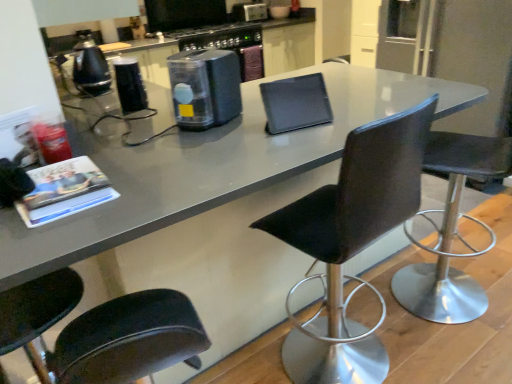
The height and width of the screenshot is (384, 512). What do you see at coordinates (249, 12) in the screenshot? I see `metallic silver toaster at upper center, the third appliance from the bottom` at bounding box center [249, 12].

Locate an element on the screen. This screenshot has height=384, width=512. black leather chair at center, the 2th chair positioned from the right is located at coordinates (351, 243).

Identify the location of matte gray countertop at center. The width and height of the screenshot is (512, 384). (212, 166).

Measure the distance between point [218,92] and camera.

Point [218,92] and camera are 1.46 meters apart from each other.

The image size is (512, 384). Find the location of `transparent plastic container at center, acting as the first appliance starting from the front`. transparent plastic container at center, acting as the first appliance starting from the front is located at coordinates (205, 88).

The image size is (512, 384). What do you see at coordinates (90, 66) in the screenshot? I see `black glossy kettle at left, the first appliance viewed from the left` at bounding box center [90, 66].

What are the coordinates of `black leather chair at lower left, marked as the third chair in a right-to-left arrangement` in the screenshot? It's located at (100, 331).

Is black leather chair at center, the 2th chair positioned from the right, facing towards black leather chair at right, the first chair in the right-to-left sequence?

No, black leather chair at center, the 2th chair positioned from the right, does not turn towards black leather chair at right, the first chair in the right-to-left sequence.

From the picture: Does black leather chair at center, the 2th chair positioned from the right, touch black leather chair at right, the third chair from the left?

black leather chair at center, the 2th chair positioned from the right, is not next to black leather chair at right, the third chair from the left, and they're not touching.

Image resolution: width=512 pixels, height=384 pixels. There is a black leather chair at right, the first chair in the right-to-left sequence. Find the location of `the 1st chair below it (from the image's perspective)`. the 1st chair below it (from the image's perspective) is located at coordinates (351, 243).

Which object is thinner, metallic silver toaster at upper center, the 3th appliance positioned from the left, or black glossy kettle at left, which is counted as the second appliance, starting from the front?

black glossy kettle at left, which is counted as the second appliance, starting from the front, is thinner.

Relative to black glossy kettle at left, which ranks as the third appliance in right-to-left order, is metallic silver toaster at upper center, arranged as the third appliance when viewed from the front, in front or behind?

metallic silver toaster at upper center, arranged as the third appliance when viewed from the front, is positioned farther from the viewer than black glossy kettle at left, which ranks as the third appliance in right-to-left order.

From the image's perspective, is metallic silver toaster at upper center, arranged as the first appliance when viewed from the back, above black glossy kettle at left, which is counted as the second appliance, starting from the front?

Indeed, from the image's perspective, metallic silver toaster at upper center, arranged as the first appliance when viewed from the back, is shown above black glossy kettle at left, which is counted as the second appliance, starting from the front.

Would you say metallic silver toaster at upper center, arranged as the third appliance when viewed from the front, is inside or outside black glossy kettle at left, the second appliance viewed from the back?

metallic silver toaster at upper center, arranged as the third appliance when viewed from the front, is not inside black glossy kettle at left, the second appliance viewed from the back, it's outside.

Is matte gray countertop at center not close to metallic silver toaster at upper center, the 3th appliance positioned from the left?

Yes.

Is point (201, 180) positioned in front of point (252, 4)?

Yes, point (201, 180) is closer to viewer.

From the image's perspective, starting from the matte gray countertop at center, which appliance is the 3rd one above? Please provide its 2D coordinates.

[(249, 12)]

Considering the relative positions of matte gray countertop at center and metallic silver toaster at upper center, arranged as the first appliance when viewed from the back, in the image provided, is matte gray countertop at center to the right of metallic silver toaster at upper center, arranged as the first appliance when viewed from the back, from the viewer's perspective?

Correct, you'll find matte gray countertop at center to the right of metallic silver toaster at upper center, arranged as the first appliance when viewed from the back.

Would you consider black leather chair at right, the third chair from the left, to be distant from transparent plastic container at center, marked as the 3th appliance in a top-to-bottom arrangement?

Yes, black leather chair at right, the third chair from the left, and transparent plastic container at center, marked as the 3th appliance in a top-to-bottom arrangement, are located far from each other.

Which chair is the 1st one when counting from the front of the transparent plastic container at center, marked as the second appliance in a right-to-left arrangement? Please provide its 2D coordinates.

[(451, 231)]

Which of these two, black leather chair at right, the third chair from the left, or transparent plastic container at center, marked as the 3th appliance in a top-to-bottom arrangement, is smaller?

Smaller between the two is transparent plastic container at center, marked as the 3th appliance in a top-to-bottom arrangement.

Is point (455, 188) closer to camera compared to point (208, 80)?

No, it is not.

Considering the relative sizes of transparent plastic container at center, marked as the second appliance in a right-to-left arrangement, and black leather chair at lower left, marked as the third chair in a right-to-left arrangement, in the image provided, is transparent plastic container at center, marked as the second appliance in a right-to-left arrangement, smaller than black leather chair at lower left, marked as the third chair in a right-to-left arrangement,?

Correct, transparent plastic container at center, marked as the second appliance in a right-to-left arrangement, occupies less space than black leather chair at lower left, marked as the third chair in a right-to-left arrangement.

Which is behind, point (175, 117) or point (203, 328)?

The point (175, 117) is farther.

How many degrees apart are the facing directions of transparent plastic container at center, marked as the second appliance in a right-to-left arrangement, and black leather chair at lower left, marked as the third chair in a right-to-left arrangement?

There is a 58.7-degree angle between the facing directions of transparent plastic container at center, marked as the second appliance in a right-to-left arrangement, and black leather chair at lower left, marked as the third chair in a right-to-left arrangement.

How distant is transparent plastic container at center, marked as the 3th appliance in a top-to-bottom arrangement, from black leather chair at lower left, marked as the third chair in a right-to-left arrangement?

transparent plastic container at center, marked as the 3th appliance in a top-to-bottom arrangement, and black leather chair at lower left, marked as the third chair in a right-to-left arrangement, are 73.87 centimeters apart from each other.

Where is `appliance below the black glossy kettle at left, the second appliance viewed from the back (from the image's perspective)`? The width and height of the screenshot is (512, 384). appliance below the black glossy kettle at left, the second appliance viewed from the back (from the image's perspective) is located at coordinates (205, 88).

What's the angular difference between black glossy kettle at left, which ranks as the third appliance in right-to-left order, and transparent plastic container at center, acting as the first appliance starting from the front,'s facing directions?

31.5 degrees separate the facing orientations of black glossy kettle at left, which ranks as the third appliance in right-to-left order, and transparent plastic container at center, acting as the first appliance starting from the front.

Between black glossy kettle at left, the second appliance viewed from the back, and transparent plastic container at center, marked as the 3th appliance in a top-to-bottom arrangement, which one appears on the right side from the viewer's perspective?

transparent plastic container at center, marked as the 3th appliance in a top-to-bottom arrangement.

In the scene shown: Considering the sizes of objects black glossy kettle at left, the second appliance positioned from the bottom, and transparent plastic container at center, acting as the second appliance starting from the left, in the image provided, who is thinner, black glossy kettle at left, the second appliance positioned from the bottom, or transparent plastic container at center, acting as the second appliance starting from the left,?

Thinner between the two is black glossy kettle at left, the second appliance positioned from the bottom.

There is a matte gray countertop at center. Where is `magazine above it (from a real-world perspective)`? This screenshot has width=512, height=384. magazine above it (from a real-world perspective) is located at coordinates (64, 191).

From a real-world perspective, is matte gray countertop at center located beneath matte black magazine at left?

Yes, from a real-world perspective, matte gray countertop at center is below matte black magazine at left.

Does matte gray countertop at center have a lesser width compared to matte black magazine at left?

No, matte gray countertop at center is not thinner than matte black magazine at left.

I want to click on chair that appears above the black leather chair at center, acting as the second chair starting from the left (from the image's perspective), so pyautogui.click(x=451, y=231).

This screenshot has width=512, height=384. What are the coordinates of `the 1st appliance below the metallic silver toaster at upper center, arranged as the third appliance when viewed from the front (from the image's perspective)` in the screenshot? It's located at (90, 66).

Which object lies nearer to the anchor point matte gray countertop at center, black leather chair at lower left, the first chair in the left-to-right sequence, or metallic silver toaster at upper center, the first appliance in the right-to-left sequence?

black leather chair at lower left, the first chair in the left-to-right sequence, is closer to matte gray countertop at center.

When comparing their distances from black leather chair at center, acting as the second chair starting from the left, does metallic silver toaster at upper center, the first appliance in the right-to-left sequence, or black leather chair at lower left, marked as the third chair in a right-to-left arrangement, seem further?

Based on the image, metallic silver toaster at upper center, the first appliance in the right-to-left sequence, appears to be further to black leather chair at center, acting as the second chair starting from the left.

Which object lies further to the anchor point black glossy kettle at left, which ranks as the third appliance in right-to-left order, black leather chair at right, the first chair in the right-to-left sequence, or black leather chair at center, acting as the second chair starting from the left?

The object further to black glossy kettle at left, which ranks as the third appliance in right-to-left order, is black leather chair at right, the first chair in the right-to-left sequence.

Considering their positions, is black leather chair at right, the first chair in the right-to-left sequence, positioned closer to transparent plastic container at center, marked as the 3th appliance in a top-to-bottom arrangement, than black leather chair at lower left, marked as the third chair in a right-to-left arrangement?

black leather chair at lower left, marked as the third chair in a right-to-left arrangement, is closer to transparent plastic container at center, marked as the 3th appliance in a top-to-bottom arrangement.

Consider the image. Considering their positions, is matte gray countertop at center positioned further to black leather chair at center, acting as the second chair starting from the left, than black leather chair at right, the first chair in the right-to-left sequence?

The object further to black leather chair at center, acting as the second chair starting from the left, is black leather chair at right, the first chair in the right-to-left sequence.

Looking at the image, which one is located further to black leather chair at right, the first chair in the right-to-left sequence, matte black magazine at left or transparent plastic container at center, acting as the second appliance starting from the left?

matte black magazine at left.

Considering their positions, is transparent plastic container at center, acting as the first appliance starting from the front, positioned closer to black leather chair at right, the third chair from the left, than matte black magazine at left?

transparent plastic container at center, acting as the first appliance starting from the front, is positioned closer to the anchor black leather chair at right, the third chair from the left.

In the scene shown: Looking at the image, which one is located further to black leather chair at lower left, the first chair in the left-to-right sequence, black glossy kettle at left, which is counted as the second appliance, starting from the front, or matte gray countertop at center?

Based on the image, black glossy kettle at left, which is counted as the second appliance, starting from the front, appears to be further to black leather chair at lower left, the first chair in the left-to-right sequence.

Identify the location of countertop between transparent plastic container at center, acting as the second appliance starting from the left, and black leather chair at lower left, the first chair in the left-to-right sequence, from top to bottom. (212, 166).

Where is `countertop between matte black magazine at left and black leather chair at right, the third chair from the left, in the horizontal direction`? The image size is (512, 384). countertop between matte black magazine at left and black leather chair at right, the third chair from the left, in the horizontal direction is located at coordinates (212, 166).

The width and height of the screenshot is (512, 384). In order to click on countertop between black leather chair at lower left, marked as the third chair in a right-to-left arrangement, and black leather chair at center, acting as the second chair starting from the left, in the horizontal direction in this screenshot , I will do `click(212, 166)`.

Where is `countertop that lies between transparent plastic container at center, marked as the second appliance in a right-to-left arrangement, and black leather chair at center, acting as the second chair starting from the left, from top to bottom`? countertop that lies between transparent plastic container at center, marked as the second appliance in a right-to-left arrangement, and black leather chair at center, acting as the second chair starting from the left, from top to bottom is located at coordinates (212, 166).